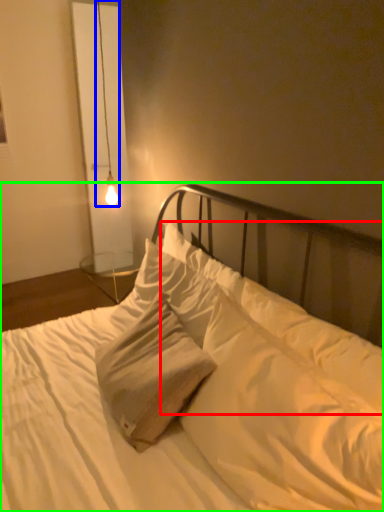
Question: Which object is positioned closest to pillow (highlighted by a red box)? Select from lamp (highlighted by a blue box) and bed (highlighted by a green box).

Choices:
 (A) lamp
 (B) bed

Answer: (B)